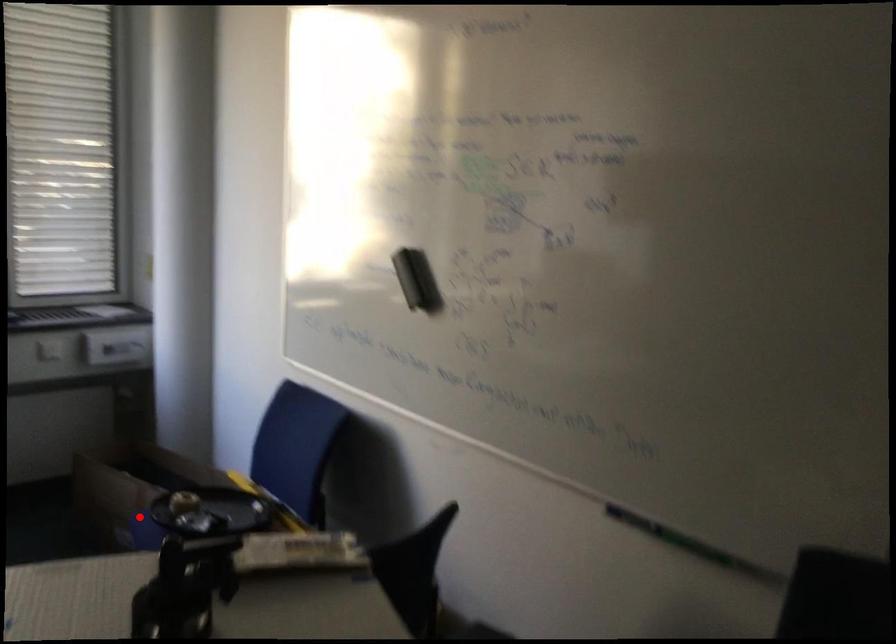
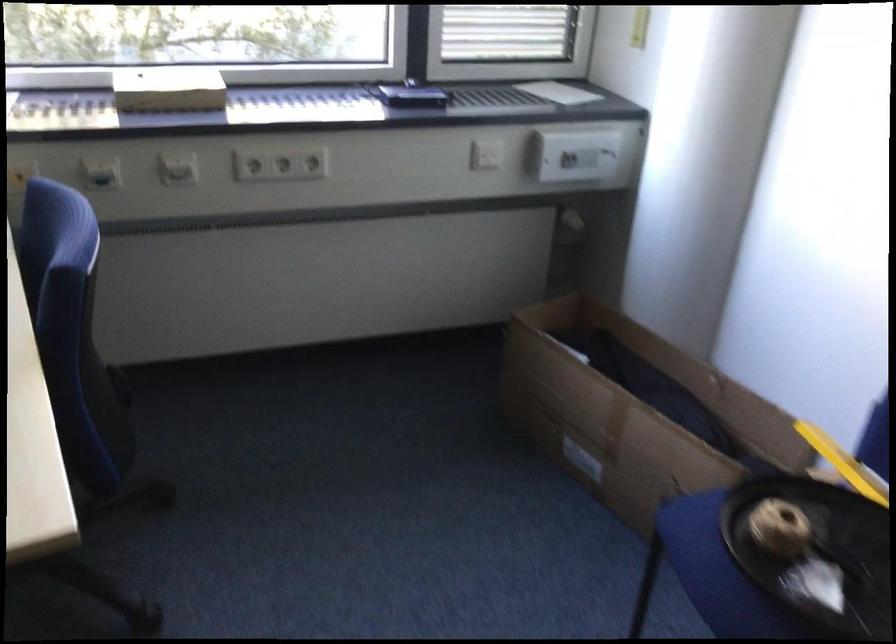
Question: I am providing you with two images of the same scene from different viewpoints. In image1, a red point is highlighted. Considering the same 3D point in image2, which of the following is correct?

Choices:
 (A) It is closer
 (B) It is farther

Answer: (A)